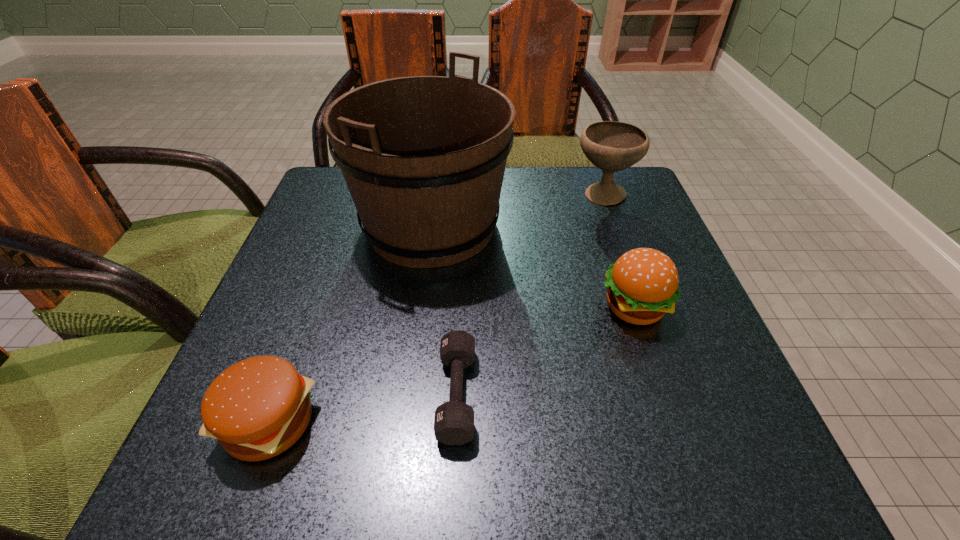
Where is `bucket`? This screenshot has width=960, height=540. bucket is located at coordinates (424, 157).

Locate an element on the screen. The height and width of the screenshot is (540, 960). chalice is located at coordinates (612, 146).

The image size is (960, 540). I want to click on the third tallest object, so 642,285.

The width and height of the screenshot is (960, 540). Find the location of `the farther hamburger`. the farther hamburger is located at coordinates (642, 285).

Image resolution: width=960 pixels, height=540 pixels. I want to click on the nearer hamburger, so click(x=257, y=408).

This screenshot has height=540, width=960. What are the coordinates of `the shorter hamburger` in the screenshot? It's located at 257,408.

The width and height of the screenshot is (960, 540). I want to click on dumbbell, so click(x=454, y=420).

At what (x,y) coordinates should I click in order to perform the action: click on free region located 0.050m on the front of the tallest object. Please return your answer as a coordinate pair (x, y). Looking at the image, I should click on (421, 299).

Where is `vacant space located on the front of the second tallest object`? vacant space located on the front of the second tallest object is located at coordinates (653, 336).

Locate an element on the screen. The width and height of the screenshot is (960, 540). vacant point located on the left of the taller hamburger is located at coordinates (570, 307).